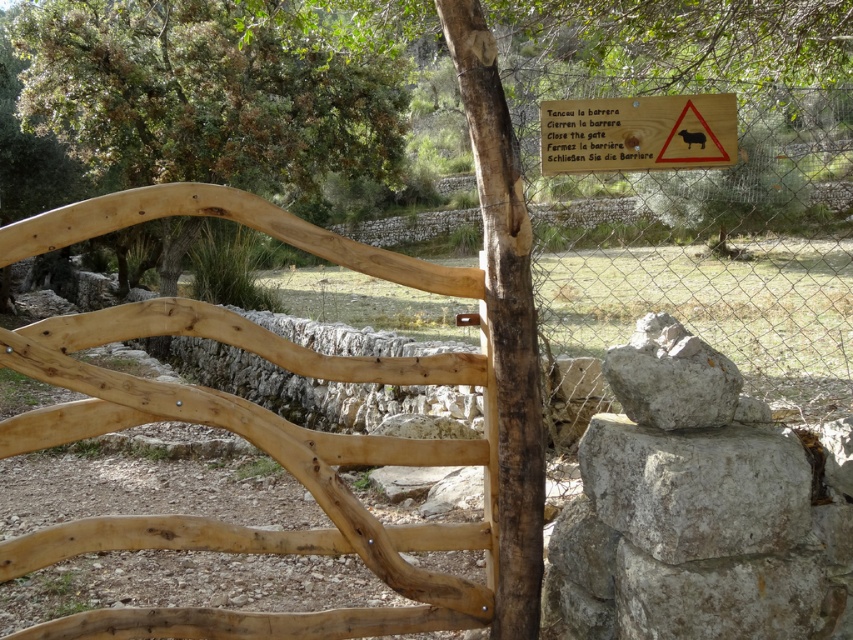
Can you confirm if gray rough stone at center is wider than gray rough rock at center-right?

Indeed, gray rough stone at center has a greater width compared to gray rough rock at center-right.

Is point (689, 529) behind point (698, 426)?

No, (689, 529) is in front of (698, 426).

Find the location of a particular element. Image resolution: width=853 pixels, height=640 pixels. gray rough stone at center is located at coordinates (697, 486).

Does wooden sign at center come behind gray rough rock at center-right?

Yes, wooden sign at center is behind gray rough rock at center-right.

Can you confirm if wooden sign at center is positioned to the left of gray rough rock at center-right?

Indeed, wooden sign at center is positioned on the left side of gray rough rock at center-right.

Where is `wooden sign at center`? This screenshot has height=640, width=853. wooden sign at center is located at coordinates click(x=637, y=132).

Which is more to the left, natural wood gate at center or gray rough rock at center-right?

natural wood gate at center

Does natural wood gate at center have a lesser width compared to gray rough rock at center-right?

No, natural wood gate at center is not thinner than gray rough rock at center-right.

Which is in front, point (349, 508) or point (695, 394)?

Positioned in front is point (695, 394).

The image size is (853, 640). Find the location of `natural wood gate at center`. natural wood gate at center is located at coordinates (259, 449).